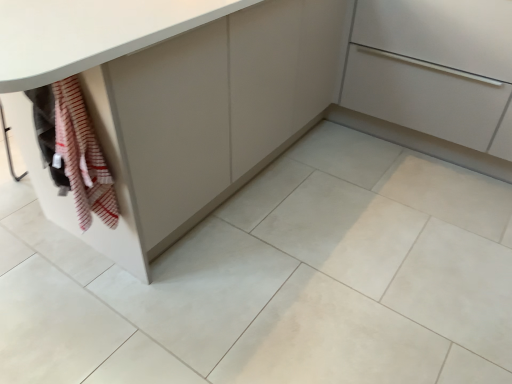
Where is `white glossy tile at lower left`? white glossy tile at lower left is located at coordinates (53, 326).

Which is behind, point (419, 39) or point (83, 128)?

Point (419, 39)

From the picture: Is matte white cabinet at center, the 2th cabinetry viewed from the left, further to the viewer compared to striped cotton towel at lower left?

Yes, it is behind striped cotton towel at lower left.

Is the surface of matte white cabinet at center, the 2th cabinetry viewed from the left, in direct contact with striped cotton towel at lower left?

There is a gap between matte white cabinet at center, the 2th cabinetry viewed from the left, and striped cotton towel at lower left.

How distant is matte white cabinet at center, the 2th cabinetry viewed from the left, from striped cotton towel at lower left?

matte white cabinet at center, the 2th cabinetry viewed from the left, and striped cotton towel at lower left are 1.57 meters apart from each other.

Is point (472, 76) closer to viewer compared to point (50, 303)?

That is False.

Between matte white cabinet at center, the 2th cabinetry viewed from the left, and white glossy tile at lower left, which one is positioned behind?

matte white cabinet at center, the 2th cabinetry viewed from the left, is further from the camera.

Where is `the 1st cabinetry directly above the white glossy tile at lower left (from a real-world perspective)`? Image resolution: width=512 pixels, height=384 pixels. the 1st cabinetry directly above the white glossy tile at lower left (from a real-world perspective) is located at coordinates (435, 69).

How distant is matte white cabinet at center, the 2th cabinetry viewed from the left, from white glossy tile at lower left?

matte white cabinet at center, the 2th cabinetry viewed from the left, is 5.89 feet away from white glossy tile at lower left.

From the picture: Considering the relative sizes of matte gray cabinet at lower left, the 1th cabinetry viewed from the left, and white glossy tile at lower left in the image provided, is matte gray cabinet at lower left, the 1th cabinetry viewed from the left, smaller than white glossy tile at lower left?

Incorrect, matte gray cabinet at lower left, the 1th cabinetry viewed from the left, is not smaller in size than white glossy tile at lower left.

Is matte gray cabinet at lower left, the 1th cabinetry viewed from the left, at the right side of white glossy tile at lower left?

Correct, you'll find matte gray cabinet at lower left, the 1th cabinetry viewed from the left, to the right of white glossy tile at lower left.

Is white glossy tile at lower left inside matte gray cabinet at lower left, the 1th cabinetry viewed from the left?

That's incorrect, white glossy tile at lower left is not inside matte gray cabinet at lower left, the 1th cabinetry viewed from the left.

Could you measure the distance between matte gray cabinet at lower left, acting as the second cabinetry starting from the right, and white glossy tile at lower left?

28.46 inches.

From the picture: Which of these two, white glossy tile at lower left or matte gray cabinet at lower left, acting as the second cabinetry starting from the right, stands taller?

Standing taller between the two is matte gray cabinet at lower left, acting as the second cabinetry starting from the right.

In the image, is white glossy tile at lower left positioned in front of or behind matte gray cabinet at lower left, acting as the second cabinetry starting from the right?

white glossy tile at lower left is positioned farther from the viewer than matte gray cabinet at lower left, acting as the second cabinetry starting from the right.

Is white glossy tile at lower left oriented away from matte gray cabinet at lower left, the 1th cabinetry viewed from the left?

No.

Where is `ceramic tile lying behind the matte gray cabinet at lower left, the 1th cabinetry viewed from the left`? The width and height of the screenshot is (512, 384). ceramic tile lying behind the matte gray cabinet at lower left, the 1th cabinetry viewed from the left is located at coordinates (53, 326).

Which object is further away from the camera taking this photo, matte gray cabinet at lower left, the 1th cabinetry viewed from the left, or matte white cabinet at center, the 2th cabinetry viewed from the left?

matte white cabinet at center, the 2th cabinetry viewed from the left, is more distant.

You are a GUI agent. You are given a task and a screenshot of the screen. Output one action in this format:
    pyautogui.click(x=<x>, y=<y>)
    Task: Click on the cabinetry above the matte gray cabinet at lower left, the 1th cabinetry viewed from the left (from the image's perspective)
    Image resolution: width=512 pixels, height=384 pixels.
    Given the screenshot: What is the action you would take?
    pyautogui.click(x=435, y=69)

From a real-world perspective, who is located higher, matte gray cabinet at lower left, acting as the second cabinetry starting from the right, or matte white cabinet at center, the 2th cabinetry viewed from the left?

matte gray cabinet at lower left, acting as the second cabinetry starting from the right, is physically above.

Considering the relative positions of matte gray cabinet at lower left, the 1th cabinetry viewed from the left, and matte white cabinet at center, the 2th cabinetry viewed from the left, in the image provided, is matte gray cabinet at lower left, the 1th cabinetry viewed from the left, to the left of matte white cabinet at center, the 2th cabinetry viewed from the left, from the viewer's perspective?

Indeed, matte gray cabinet at lower left, the 1th cabinetry viewed from the left, is positioned on the left side of matte white cabinet at center, the 2th cabinetry viewed from the left.

Which object is closer to the camera, matte white cabinet at center, placed as the first cabinetry when sorted from right to left, or matte gray cabinet at lower left, the 1th cabinetry viewed from the left?

Positioned in front is matte gray cabinet at lower left, the 1th cabinetry viewed from the left.

Is matte white cabinet at center, the 2th cabinetry viewed from the left, positioned far away from matte gray cabinet at lower left, acting as the second cabinetry starting from the right?

matte white cabinet at center, the 2th cabinetry viewed from the left, is near matte gray cabinet at lower left, acting as the second cabinetry starting from the right, not far away.

Considering the relative positions of matte white cabinet at center, the 2th cabinetry viewed from the left, and matte gray cabinet at lower left, the 1th cabinetry viewed from the left, in the image provided, is matte white cabinet at center, the 2th cabinetry viewed from the left, to the left or to the right of matte gray cabinet at lower left, the 1th cabinetry viewed from the left,?

matte white cabinet at center, the 2th cabinetry viewed from the left, is positioned on matte gray cabinet at lower left, the 1th cabinetry viewed from the left,'s right side.

Who is shorter, matte gray cabinet at lower left, the 1th cabinetry viewed from the left, or striped cotton towel at lower left?

With less height is striped cotton towel at lower left.

Is the surface of matte gray cabinet at lower left, the 1th cabinetry viewed from the left, in direct contact with striped cotton towel at lower left?

No, matte gray cabinet at lower left, the 1th cabinetry viewed from the left, is not touching striped cotton towel at lower left.

Is matte gray cabinet at lower left, acting as the second cabinetry starting from the right, to the left or to the right of striped cotton towel at lower left in the image?

matte gray cabinet at lower left, acting as the second cabinetry starting from the right, is to the right of striped cotton towel at lower left.

Image resolution: width=512 pixels, height=384 pixels. I want to click on the 2nd cabinetry above the striped cotton towel at lower left (from the image's perspective), so click(x=435, y=69).

The width and height of the screenshot is (512, 384). Identify the location of ceramic tile that appears below the matte white cabinet at center, the 2th cabinetry viewed from the left (from the image's perspective). (53, 326).

Based on their spatial positions, is matte white cabinet at center, placed as the first cabinetry when sorted from right to left, or white glossy tile at lower left closer to matte gray cabinet at lower left, the 1th cabinetry viewed from the left?

matte white cabinet at center, placed as the first cabinetry when sorted from right to left, is positioned closer to the anchor matte gray cabinet at lower left, the 1th cabinetry viewed from the left.

Based on their spatial positions, is matte gray cabinet at lower left, the 1th cabinetry viewed from the left, or white glossy tile at lower left closer to striped cotton towel at lower left?

white glossy tile at lower left is closer to striped cotton towel at lower left.

Estimate the real-world distances between objects in this image. Which object is closer to matte gray cabinet at lower left, the 1th cabinetry viewed from the left, white glossy tile at lower left or matte white cabinet at center, placed as the first cabinetry when sorted from right to left?

Among the two, matte white cabinet at center, placed as the first cabinetry when sorted from right to left, is located nearer to matte gray cabinet at lower left, the 1th cabinetry viewed from the left.

Which object lies further to the anchor point white glossy tile at lower left, matte white cabinet at center, placed as the first cabinetry when sorted from right to left, or matte gray cabinet at lower left, acting as the second cabinetry starting from the right?

matte white cabinet at center, placed as the first cabinetry when sorted from right to left, is further to white glossy tile at lower left.

Looking at the image, which one is located closer to striped cotton towel at lower left, white glossy tile at lower left or matte white cabinet at center, placed as the first cabinetry when sorted from right to left?

white glossy tile at lower left.

From the image, which object appears to be nearer to matte gray cabinet at lower left, acting as the second cabinetry starting from the right, striped cotton towel at lower left or matte white cabinet at center, the 2th cabinetry viewed from the left?

The object closer to matte gray cabinet at lower left, acting as the second cabinetry starting from the right, is matte white cabinet at center, the 2th cabinetry viewed from the left.

Which object lies nearer to the anchor point white glossy tile at lower left, striped cotton towel at lower left or matte gray cabinet at lower left, the 1th cabinetry viewed from the left?

Based on the image, striped cotton towel at lower left appears to be nearer to white glossy tile at lower left.

Considering their positions, is white glossy tile at lower left positioned further to matte white cabinet at center, placed as the first cabinetry when sorted from right to left, than matte gray cabinet at lower left, the 1th cabinetry viewed from the left?

white glossy tile at lower left lies further to matte white cabinet at center, placed as the first cabinetry when sorted from right to left, than the other object.

Where is `cabinetry situated between white glossy tile at lower left and matte white cabinet at center, placed as the first cabinetry when sorted from right to left, from left to right`? cabinetry situated between white glossy tile at lower left and matte white cabinet at center, placed as the first cabinetry when sorted from right to left, from left to right is located at coordinates (250, 93).

You are a GUI agent. You are given a task and a screenshot of the screen. Output one action in this format:
    pyautogui.click(x=<x>, y=<y>)
    Task: Click on the blanket located between white glossy tile at lower left and matte white cabinet at center, placed as the first cabinetry when sorted from right to left, in the left-right direction
    The width and height of the screenshot is (512, 384).
    Given the screenshot: What is the action you would take?
    pyautogui.click(x=82, y=156)

You are a GUI agent. You are given a task and a screenshot of the screen. Output one action in this format:
    pyautogui.click(x=<x>, y=<y>)
    Task: Click on the blanket between matte gray cabinet at lower left, acting as the second cabinetry starting from the right, and white glossy tile at lower left in the front-back direction
    This screenshot has height=384, width=512.
    Given the screenshot: What is the action you would take?
    pyautogui.click(x=82, y=156)

I want to click on cabinetry between striped cotton towel at lower left and matte white cabinet at center, placed as the first cabinetry when sorted from right to left, so click(250, 93).